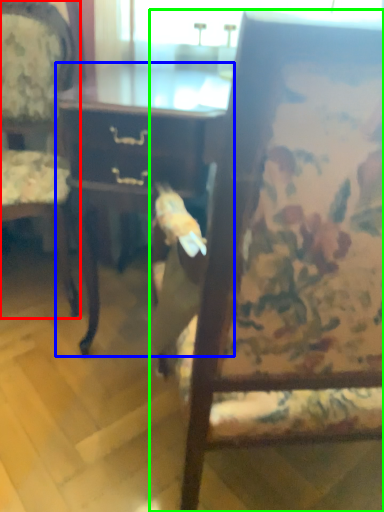
Question: Considering the real-world distances, which object is closest to chair (highlighted by a red box)? desk (highlighted by a blue box) or chair (highlighted by a green box).

Choices:
 (A) desk
 (B) chair

Answer: (A)